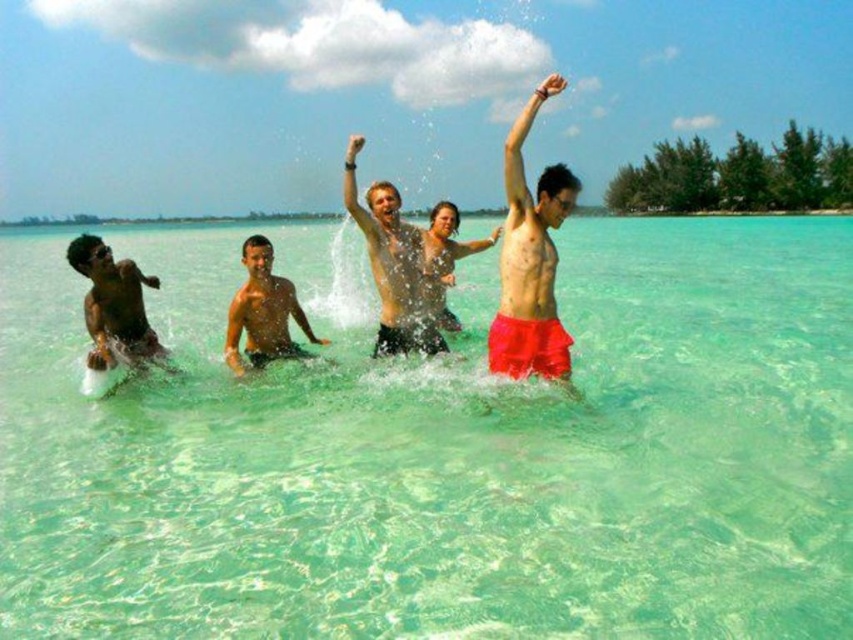
Which is more to the right, matte black man at left or smooth skin man at center?

From the viewer's perspective, smooth skin man at center appears more on the right side.

The width and height of the screenshot is (853, 640). In order to click on matte black man at left in this screenshot , I will do `click(113, 305)`.

Which is behind, point (100, 323) or point (264, 259)?

The point (264, 259) is behind.

Find the location of `matte black man at left`. matte black man at left is located at coordinates (113, 305).

Can you confirm if smooth black shorts at center is taller than smooth skin man at center?

Yes.

Does point (408, 234) come closer to viewer compared to point (241, 252)?

Yes, it is in front of point (241, 252).

Identify the location of smooth black shorts at center. (392, 264).

Is red matte shorts at center smaller than smooth black shorts at center?

No.

Between point (556, 170) and point (422, 346), which one is positioned behind?

Positioned behind is point (422, 346).

Image resolution: width=853 pixels, height=640 pixels. I want to click on red matte shorts at center, so click(531, 260).